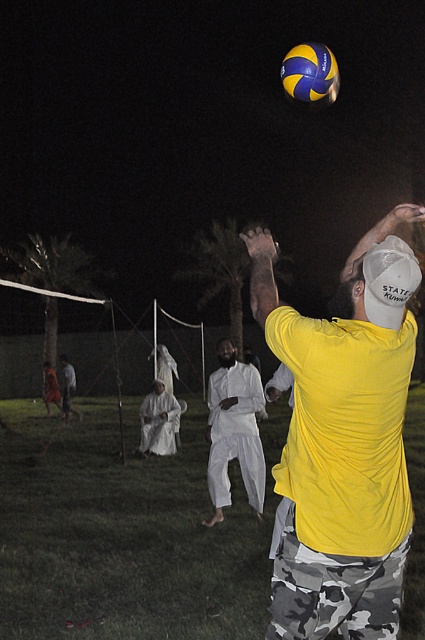
Between yellow matte shirt at upper right and blue and yellow textured volleyball at upper center, which one has less height?

With less height is blue and yellow textured volleyball at upper center.

Measure the distance between yellow matte shirt at upper right and blue and yellow textured volleyball at upper center.

yellow matte shirt at upper right and blue and yellow textured volleyball at upper center are 2.49 meters apart.

Is point (391, 520) in front of point (297, 51)?

Yes, it is in front of point (297, 51).

Locate an element on the screen. yellow matte shirt at upper right is located at coordinates (340, 452).

Is point (280, 328) positioned in front of point (416, 276)?

That is False.

Can you confirm if yellow matte shirt at upper right is positioned to the left of white mesh baseball cap at upper right?

Yes, yellow matte shirt at upper right is to the left of white mesh baseball cap at upper right.

Is point (334, 508) more distant than point (408, 273)?

That is True.

This screenshot has width=425, height=640. I want to click on yellow matte shirt at upper right, so click(x=340, y=452).

Image resolution: width=425 pixels, height=640 pixels. What do you see at coordinates (234, 432) in the screenshot? I see `white cotton pants at center` at bounding box center [234, 432].

Is white cotton pants at center bigger than blue and yellow textured volleyball at upper center?

No, white cotton pants at center is not bigger than blue and yellow textured volleyball at upper center.

In order to click on white cotton pants at center in this screenshot , I will do `click(234, 432)`.

Locate an element on the screen. white cotton pants at center is located at coordinates (234, 432).